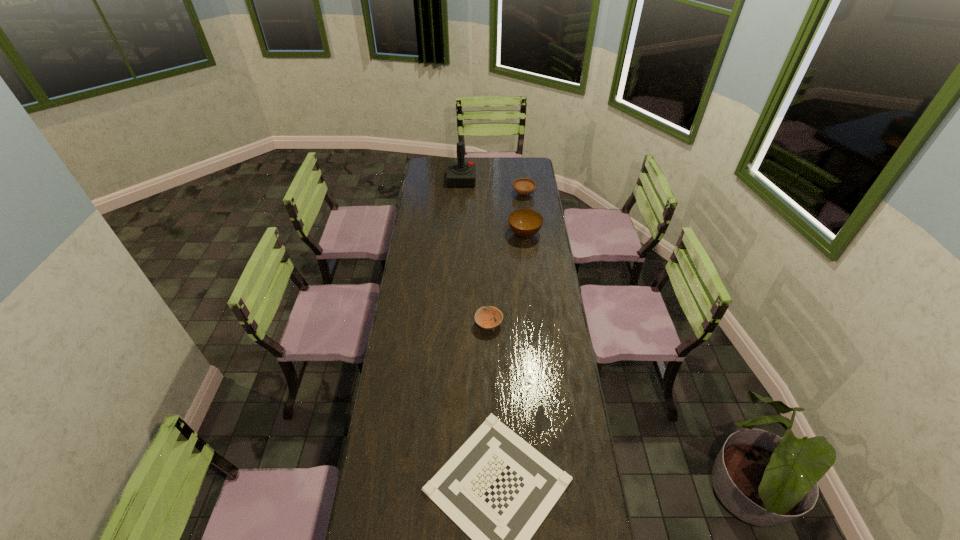
Find the location of a particular element. joystick is located at coordinates (459, 174).

Identify the location of the fourth shortest object. Image resolution: width=960 pixels, height=540 pixels. (525, 223).

What are the coordinates of `the third nearest object` in the screenshot? It's located at (525, 223).

Identify the location of the second tallest bowl. This screenshot has height=540, width=960. (523, 186).

You are a GUI agent. You are given a task and a screenshot of the screen. Output one action in this format:
    pyautogui.click(x=<x>, y=<y>)
    Task: Click on the third shortest object
    The height and width of the screenshot is (540, 960).
    Given the screenshot: What is the action you would take?
    [523, 186]

The width and height of the screenshot is (960, 540). Find the location of `the shortest bowl`. the shortest bowl is located at coordinates (485, 319).

The height and width of the screenshot is (540, 960). I want to click on the nearest bowl, so click(485, 319).

The height and width of the screenshot is (540, 960). I want to click on free point located on the base of the joystick, so click(528, 180).

Image resolution: width=960 pixels, height=540 pixels. I want to click on free region located 0.140m on the left of the third farthest object, so click(481, 234).

This screenshot has height=540, width=960. Identify the location of vacant space located on the left of the farthest bowl. (497, 194).